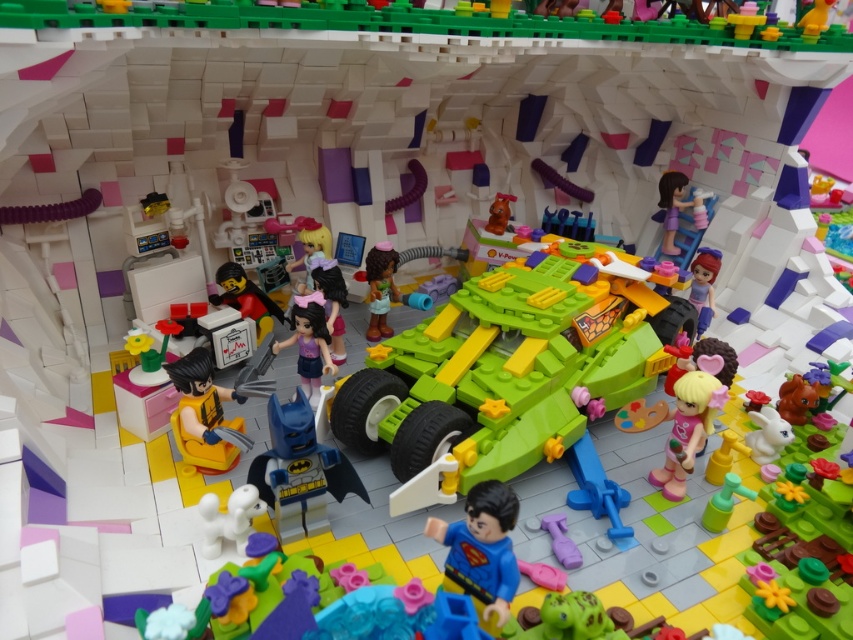
Based on the photo, you are a LEGO figure trying to decide which item to grab first. The purple matte dress at center and the white matte dog at center are both in your path. Which one is bigger and easier to pick up?

The purple matte dress at center is larger in size than the white matte dog at center, making it easier to pick up.